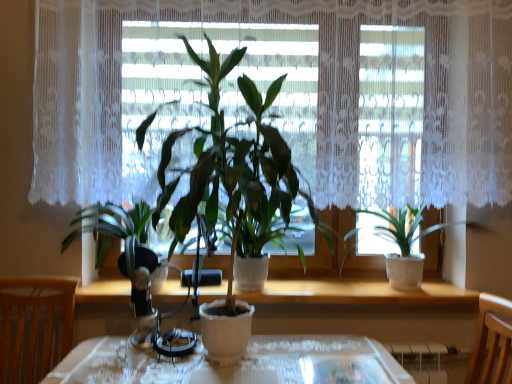
Question: Can you confirm if wooden at center is wider than wooden chair at left?

Choices:
 (A) no
 (B) yes

Answer: (A)

Question: From the image's perspective, is wooden at center over wooden chair at left?

Choices:
 (A) yes
 (B) no

Answer: (A)

Question: Is wooden at center at the left side of wooden chair at left?

Choices:
 (A) no
 (B) yes

Answer: (A)

Question: Is wooden at center oriented towards wooden chair at left?

Choices:
 (A) yes
 (B) no

Answer: (B)

Question: Is wooden at center turned away from wooden chair at left?

Choices:
 (A) yes
 (B) no

Answer: (B)

Question: From the image's perspective, is wooden at center located beneath wooden chair at left?

Choices:
 (A) yes
 (B) no

Answer: (B)

Question: From the image's perspective, does green matte plant at center, placed as the 2th houseplant when sorted from right to left, appear higher than green matte plant at left, which ranks as the first houseplant in left-to-right order?

Choices:
 (A) yes
 (B) no

Answer: (A)

Question: Does green matte plant at center, placed as the 2th houseplant when sorted from right to left, have a smaller size compared to green matte plant at left, which ranks as the first houseplant in left-to-right order?

Choices:
 (A) yes
 (B) no

Answer: (B)

Question: Is green matte plant at center, placed as the 2th houseplant when sorted from right to left, oriented towards green matte plant at left, which is the third houseplant from right to left?

Choices:
 (A) no
 (B) yes

Answer: (A)

Question: From a real-world perspective, is green matte plant at center, placed as the 2th houseplant when sorted from right to left, over green matte plant at left, which is the third houseplant from right to left?

Choices:
 (A) yes
 (B) no

Answer: (A)

Question: Would you say green matte plant at center, which is the 2th houseplant from left to right, is a long distance from green matte plant at left, which ranks as the first houseplant in left-to-right order?

Choices:
 (A) no
 (B) yes

Answer: (A)

Question: Is green matte plant at left, which is the third houseplant from right to left, located within green matte plant at center, which is the 2th houseplant from left to right?

Choices:
 (A) no
 (B) yes

Answer: (A)

Question: Considering the relative sizes of green matte plant at center, placed as the 2th houseplant when sorted from right to left, and white lace curtain at center in the image provided, is green matte plant at center, placed as the 2th houseplant when sorted from right to left, shorter than white lace curtain at center?

Choices:
 (A) no
 (B) yes

Answer: (A)